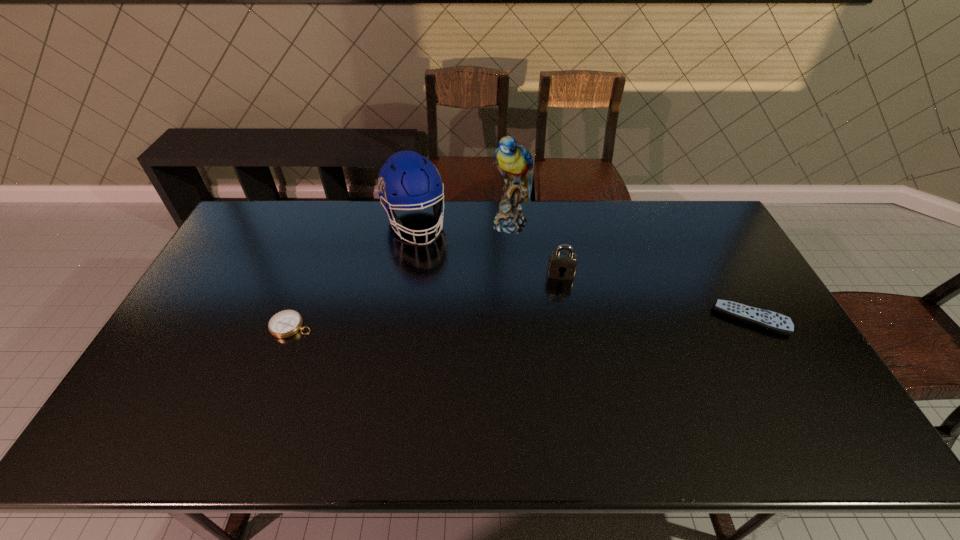
Where is `vacant space located 0.050m on the face of the parrot`? Image resolution: width=960 pixels, height=540 pixels. vacant space located 0.050m on the face of the parrot is located at coordinates (510, 248).

I want to click on vacant space located 0.270m on the face of the parrot, so click(x=507, y=295).

You are a GUI agent. You are given a task and a screenshot of the screen. Output one action in this format:
    pyautogui.click(x=<x>, y=<y>)
    Task: Click on the free space located 0.280m on the face of the parrot
    The image size is (960, 540).
    Given the screenshot: What is the action you would take?
    pyautogui.click(x=507, y=297)

Find the location of a particular element. vacant region located on the front-facing side of the second object from left to right is located at coordinates (459, 328).

You are a GUI agent. You are given a task and a screenshot of the screen. Output one action in this format:
    pyautogui.click(x=<x>, y=<y>)
    Task: Click on the free space located on the front-facing side of the second object from left to right
    
    Given the screenshot: What is the action you would take?
    pyautogui.click(x=460, y=330)

Identify the location of free region located on the front-facing side of the second object from left to right. (455, 320).

The image size is (960, 540). Find the location of `blank space located 0.120m at the front of the third nearest object near the keyhole`. blank space located 0.120m at the front of the third nearest object near the keyhole is located at coordinates (561, 308).

Locate an element on the screen. vacant space situated 0.270m at the front of the third nearest object near the keyhole is located at coordinates (561, 349).

Identify the location of free space located at the front of the third nearest object near the keyhole. The height and width of the screenshot is (540, 960). (561, 313).

Locate an element on the screen. parrot at the far edge is located at coordinates (514, 162).